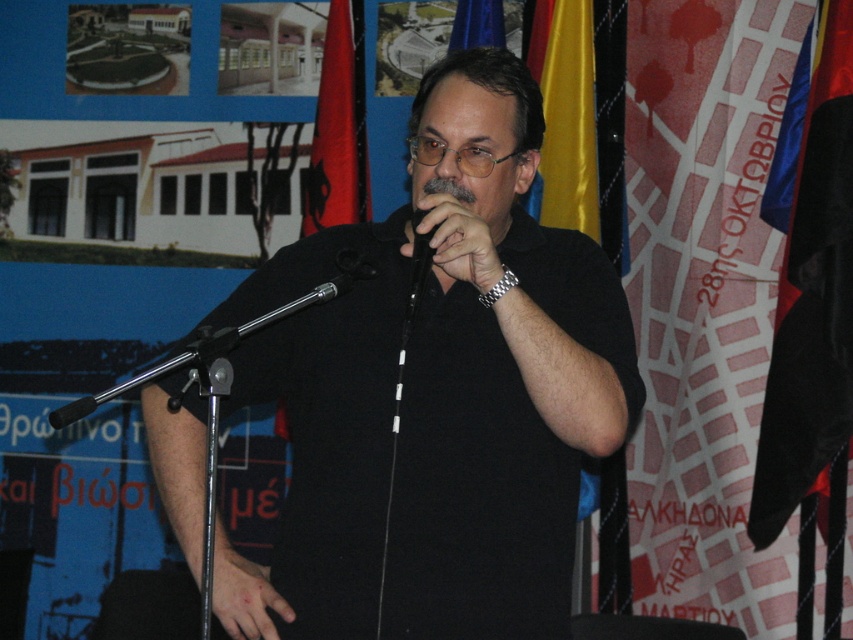
Question: Which point is closer to the camera?

Choices:
 (A) black fabric flag at right
 (B) black metallic microphone at center
 (C) yellow satin flag at upper right

Answer: (B)

Question: From the image, what is the correct spatial relationship of red fabric flag at upper center in relation to black fabric flag at right?

Choices:
 (A) above
 (B) below

Answer: (A)

Question: Is black matte shirt at center below yellow satin flag at upper right?

Choices:
 (A) yes
 (B) no

Answer: (A)

Question: Which is nearer to the leather skin at center?

Choices:
 (A) black metallic microphone at center
 (B) red fabric flag at upper center
 (C) black matte shirt at center

Answer: (C)

Question: Which object is farther from the camera taking this photo?

Choices:
 (A) black matte shirt at center
 (B) red fabric flag at upper center
 (C) leather skin at center
 (D) black leather microphone at center

Answer: (B)

Question: Is red fabric flag at upper center bigger than black metallic microphone at center?

Choices:
 (A) yes
 (B) no

Answer: (A)